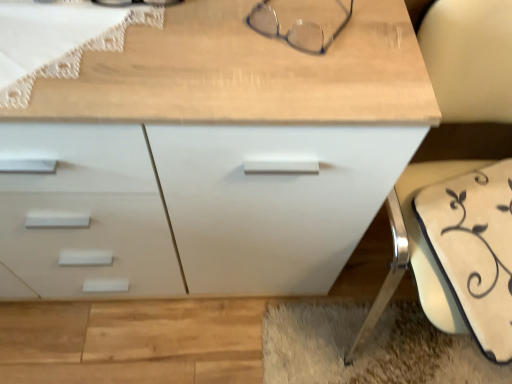
Question: Is white fabric swivel chair at lower right spatially inside clear plastic glasses at upper center, or outside of it?

Choices:
 (A) outside
 (B) inside

Answer: (A)

Question: Visually, is white fabric swivel chair at lower right positioned to the left or to the right of clear plastic glasses at upper center?

Choices:
 (A) right
 (B) left

Answer: (A)

Question: Which is nearer to the clear plastic glasses at upper center?

Choices:
 (A) white fabric swivel chair at lower right
 (B) white matte chest of drawers at center

Answer: (B)

Question: Based on their relative distances, which object is nearer to the white fabric swivel chair at lower right?

Choices:
 (A) clear plastic glasses at upper center
 (B) white matte chest of drawers at center

Answer: (B)